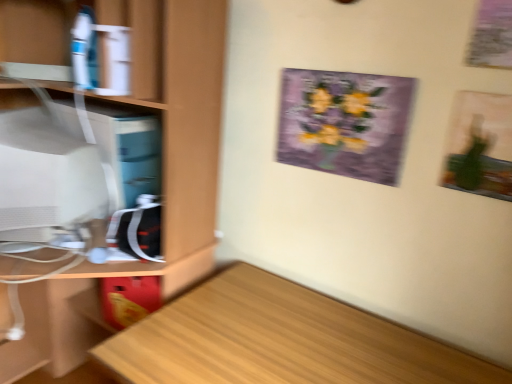
Describe the element at coordinates (344, 123) in the screenshot. This screenshot has height=384, width=512. I see `purple paper picture frame at upper center` at that location.

This screenshot has height=384, width=512. What are the coordinates of `matte white monitor at left` in the screenshot? It's located at (45, 177).

This screenshot has width=512, height=384. What do you see at coordinates (280, 340) in the screenshot?
I see `light wood desk at lower left` at bounding box center [280, 340].

Locate an element on the screen. The height and width of the screenshot is (384, 512). wooden cabinet at left is located at coordinates (162, 180).

Identify the location of purple paper picture frame at upper center. (344, 123).

From a real-world perspective, is matte white monitor at left above or below purple paper picture frame at upper center?

Clearly, from a real-world perspective, matte white monitor at left is below purple paper picture frame at upper center.

Which point is more forward, (x=10, y=232) or (x=293, y=83)?

The point (x=10, y=232) is in front.

Is purple paper picture frame at upper center completely or partially inside matte white monitor at left?

Definitely not — purple paper picture frame at upper center is not inside matte white monitor at left.

Between wooden cabinet at left and light wood desk at lower left, which one has less height?

Standing shorter between the two is light wood desk at lower left.

Does point (144, 0) lie behind point (312, 349)?

Yes, it is.

Is wooden cabinet at left far from light wood desk at lower left?

They are positioned close to each other.

From the image's perspective, does wooden cabinet at left appear lower than matte white monitor at left?

Yes.

Is wooden cabinet at left spatially inside matte white monitor at left, or outside of it?

wooden cabinet at left lies outside matte white monitor at left.

Can you confirm if wooden cabinet at left is smaller than matte white monitor at left?

Incorrect, wooden cabinet at left is not smaller in size than matte white monitor at left.

Can you confirm if wooden cabinet at left is taller than purple paper picture frame at upper center?

Indeed, wooden cabinet at left has a greater height compared to purple paper picture frame at upper center.

From a real-world perspective, who is located lower, wooden cabinet at left or purple paper picture frame at upper center?

In real-world perspective, wooden cabinet at left is lower.

Image resolution: width=512 pixels, height=384 pixels. What are the coordinates of `picture frame behind the wooden cabinet at left` in the screenshot? It's located at (344, 123).

In the scene shown: Which object is further away from the camera taking this photo, wooden cabinet at left or purple paper picture frame at upper center?

Positioned behind is purple paper picture frame at upper center.

Looking at the image, does matte white monitor at left seem bigger or smaller compared to light wood desk at lower left?

Considering their sizes, matte white monitor at left takes up less space than light wood desk at lower left.

How many degrees apart are the facing directions of matte white monitor at left and light wood desk at lower left?

They differ by 75.8 degrees in their facing directions.

Considering the relative sizes of matte white monitor at left and light wood desk at lower left in the image provided, is matte white monitor at left wider than light wood desk at lower left?

In fact, matte white monitor at left might be narrower than light wood desk at lower left.

Considering the relative positions of light wood desk at lower left and wooden cabinet at left in the image provided, is light wood desk at lower left behind wooden cabinet at left?

No, light wood desk at lower left is closer to the viewer.

From a real-world perspective, is light wood desk at lower left physically above wooden cabinet at left?

Incorrect, from a real-world perspective, light wood desk at lower left is lower than wooden cabinet at left.

Looking at this image, from the image's perspective, is light wood desk at lower left located beneath wooden cabinet at left?

Yes, from the image's perspective, light wood desk at lower left is beneath wooden cabinet at left.

The height and width of the screenshot is (384, 512). I want to click on picture frame above the wooden cabinet at left (from a real-world perspective), so click(x=344, y=123).

Which is nearer, (352, 103) or (215, 91)?

The point (352, 103) is more forward.

From a real-world perspective, between purple paper picture frame at upper center and wooden cabinet at left, who is vertically higher?

Result: In real-world perspective, purple paper picture frame at upper center is above.

Between purple paper picture frame at upper center and wooden cabinet at left, which one is positioned in front?

wooden cabinet at left is in front.

Locate an element on the screen. This screenshot has width=512, height=384. picture frame that is above the matte white monitor at left (from the image's perspective) is located at coordinates (344, 123).

At what (x,y) coordinates should I click in order to perform the action: click on desk lying below the wooden cabinet at left (from the image's perspective). Please return your answer as a coordinate pair (x, y). Looking at the image, I should click on (280, 340).

When comparing their distances from purple paper picture frame at upper center, does light wood desk at lower left or wooden cabinet at left seem closer?

Among the two, wooden cabinet at left is located nearer to purple paper picture frame at upper center.

When comparing their distances from purple paper picture frame at upper center, does matte white monitor at left or wooden cabinet at left seem further?

Among the two, matte white monitor at left is located further to purple paper picture frame at upper center.

When comparing their distances from purple paper picture frame at upper center, does wooden cabinet at left or light wood desk at lower left seem further?

light wood desk at lower left is further to purple paper picture frame at upper center.

Based on their spatial positions, is purple paper picture frame at upper center or wooden cabinet at left closer to matte white monitor at left?

Among the two, wooden cabinet at left is located nearer to matte white monitor at left.

Which object lies further to the anchor point matte white monitor at left, wooden cabinet at left or purple paper picture frame at upper center?

Among the two, purple paper picture frame at upper center is located further to matte white monitor at left.

Consider the image. Looking at the image, which one is located further to wooden cabinet at left, light wood desk at lower left or matte white monitor at left?

The object further to wooden cabinet at left is light wood desk at lower left.

When comparing their distances from matte white monitor at left, does purple paper picture frame at upper center or light wood desk at lower left seem closer?

light wood desk at lower left is closer to matte white monitor at left.

From the image, which object appears to be nearer to light wood desk at lower left, purple paper picture frame at upper center or wooden cabinet at left?

wooden cabinet at left.

Where is `cabinetry situated between matte white monitor at left and light wood desk at lower left from left to right`? This screenshot has height=384, width=512. cabinetry situated between matte white monitor at left and light wood desk at lower left from left to right is located at coordinates click(x=162, y=180).

What are the coordinates of `desk between matte white monitor at left and purple paper picture frame at upper center from left to right` in the screenshot? It's located at (280, 340).

The height and width of the screenshot is (384, 512). What are the coordinates of `desk situated between wooden cabinet at left and purple paper picture frame at upper center from left to right` in the screenshot? It's located at click(x=280, y=340).

Locate an element on the screen. This screenshot has height=384, width=512. cabinetry between matte white monitor at left and purple paper picture frame at upper center in the horizontal direction is located at coordinates (162, 180).